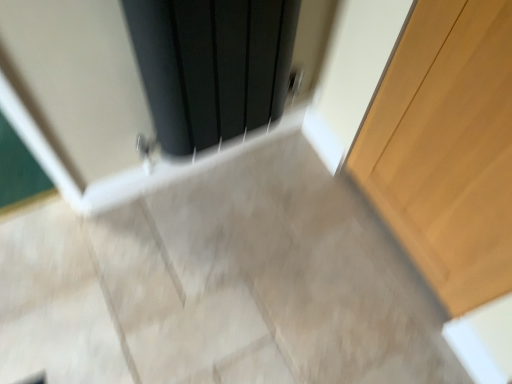
In the scene shown: Measure the distance between light wood door at right and camera.

They are 28.68 inches apart.

What do you see at coordinates (447, 148) in the screenshot? I see `light wood door at right` at bounding box center [447, 148].

Image resolution: width=512 pixels, height=384 pixels. What are the coordinates of `light wood door at right` in the screenshot? It's located at (447, 148).

In order to face light wood door at right, should I rotate leftwards or rightwards?

You should look right and rotate roughly 24.499 degrees.

Image resolution: width=512 pixels, height=384 pixels. What do you see at coordinates (212, 66) in the screenshot? I see `matte black radiator at upper center` at bounding box center [212, 66].

The image size is (512, 384). In order to click on matte black radiator at upper center in this screenshot , I will do 212,66.

Where is `light wood door at right`? The width and height of the screenshot is (512, 384). light wood door at right is located at coordinates (447, 148).

Can you confirm if matte black radiator at upper center is positioned to the left of light wood door at right?

Yes, matte black radiator at upper center is to the left of light wood door at right.

Considering their positions, is matte black radiator at upper center located in front of or behind light wood door at right?

Clearly, matte black radiator at upper center is behind light wood door at right.

Which is behind, point (219, 104) or point (471, 134)?

The point (219, 104) is behind.

From the image's perspective, between matte black radiator at upper center and light wood door at right, who is located below?

From the image's view, light wood door at right is below.

From a real-world perspective, which is physically above, matte black radiator at upper center or light wood door at right?

matte black radiator at upper center, from a real-world perspective.

Which object is wider, matte black radiator at upper center or light wood door at right?

Wider between the two is matte black radiator at upper center.

Considering the sizes of objects matte black radiator at upper center and light wood door at right in the image provided, who is shorter, matte black radiator at upper center or light wood door at right?

With less height is matte black radiator at upper center.

Which of these two, matte black radiator at upper center or light wood door at right, is bigger?

matte black radiator at upper center.

Would you say matte black radiator at upper center is outside light wood door at right?

Absolutely, matte black radiator at upper center is external to light wood door at right.

Is matte black radiator at upper center not near light wood door at right?

No, matte black radiator at upper center is not far from light wood door at right.

Is matte black radiator at upper center turned away from light wood door at right?

matte black radiator at upper center does not have its back to light wood door at right.

How different are the orientations of matte black radiator at upper center and light wood door at right in degrees?

The angular difference between matte black radiator at upper center and light wood door at right is 93.4 degrees.

How far apart are matte black radiator at upper center and light wood door at right?

matte black radiator at upper center and light wood door at right are 17.99 inches apart.

Image resolution: width=512 pixels, height=384 pixels. Identify the location of door that is in front of the matte black radiator at upper center. (447, 148).

Is light wood door at right to the left of matte black radiator at upper center from the viewer's perspective?

Incorrect, light wood door at right is not on the left side of matte black radiator at upper center.

Which object is further away from the camera taking this photo, light wood door at right or matte black radiator at upper center?

matte black radiator at upper center is further away from the camera.

Is point (384, 217) positioned behind point (262, 90)?

Yes, point (384, 217) is behind point (262, 90).

From the image's perspective, is light wood door at right on top of matte black radiator at upper center?

Actually, light wood door at right appears below matte black radiator at upper center in the image.

In the scene shown: From a real-world perspective, which object rests below the other?

From a 3D spatial view, light wood door at right is below.

Which object is wider, light wood door at right or matte black radiator at upper center?

Wider between the two is matte black radiator at upper center.

Looking at this image, which of these two, light wood door at right or matte black radiator at upper center, stands shorter?

With less height is matte black radiator at upper center.

Is light wood door at right smaller than matte black radiator at upper center?

Yes.

Is light wood door at right inside the boundaries of matte black radiator at upper center, or outside?

The correct answer is: outside.

Looking at this image, is light wood door at right next to matte black radiator at upper center and touching it?

They are not placed beside each other.

Could you tell me if light wood door at right is turned towards matte black radiator at upper center?

No, light wood door at right is not facing towards matte black radiator at upper center.

Locate an element on the screen. This screenshot has width=512, height=384. door lying on the right of matte black radiator at upper center is located at coordinates (447, 148).

In the image, there is a light wood door at right. At what (x,y) coordinates should I click in order to perform the action: click on screen door above it (from the image's perspective). Please return your answer as a coordinate pair (x, y). This screenshot has height=384, width=512. Looking at the image, I should click on (212, 66).

Where is `door in front of the matte black radiator at upper center`? This screenshot has height=384, width=512. door in front of the matte black radiator at upper center is located at coordinates (447, 148).